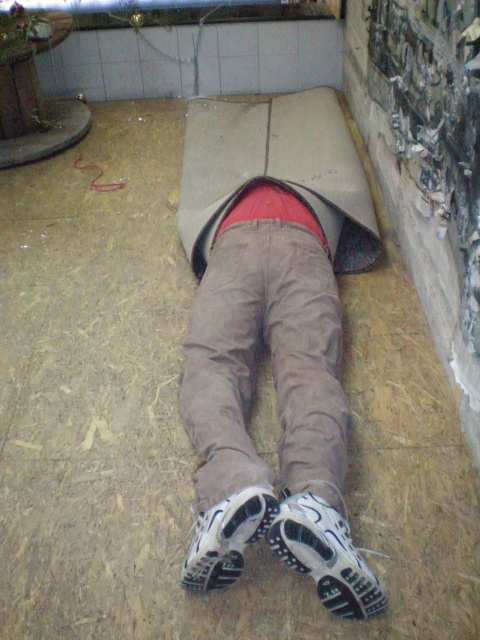
You are a delivery person who needs to pack two shoes into a box. The box can only fit one shoe at a time. You have to choose which shoe to pack first based on their sizes. Which shoe between the white mesh shoe at lower center and the white matte shoe at lower center should you pack first?

The white mesh shoe at lower center is bigger than the white matte shoe at lower center, so you should pack the white mesh shoe at lower center first to ensure it fits in the box before the smaller one.

You are a delivery person who needs to deliver a package to the person lying on the floor. The package must be placed on the floor next to their visible shoes. Which shoe should you place the package next to, the white mesh shoe at lower center or the white matte shoe at lower center?

The white mesh shoe at lower center is positioned under the white matte shoe at lower center, so the package should be placed next to the white matte shoe at lower center since it is visible on top.

You are a delivery robot trying to reach a package placed at point (324, 554). The path to this point is blocked by a white mesh shoe at lower center. Can you navigate around the shoe to reach the package?

The package is at point (324, 554) where the white mesh shoe at lower center is located, so the delivery robot cannot reach the package as it is blocked by the shoe.